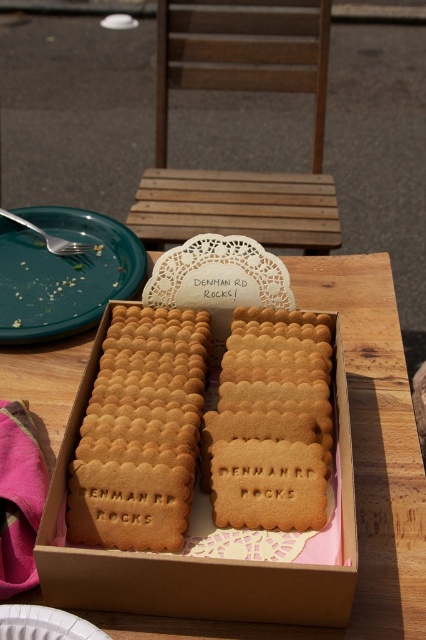
Question: Which is farther from the brown cardboard box at center?

Choices:
 (A) wooden picnic table at center
 (B) green matte plate at left
 (C) golden brown biscuit at center

Answer: (A)

Question: Which object is positioned farthest from the golden brown biscuit at center?

Choices:
 (A) green matte plate at left
 (B) brown cardboard box at center
 (C) white paper plate at lower left
 (D) wooden picnic table at center

Answer: (D)

Question: Is brown cardboard box at center wider than white paper plate at lower left?

Choices:
 (A) no
 (B) yes

Answer: (B)

Question: Does golden matte biscuit at center appear over white paper plate at lower left?

Choices:
 (A) yes
 (B) no

Answer: (A)

Question: Estimate the real-world distances between objects in this image. Which object is farther from the wooden picnic table at center?

Choices:
 (A) golden matte biscuit at center
 (B) brown cardboard box at center
 (C) green matte plate at left

Answer: (B)

Question: Observing the image, what is the correct spatial positioning of golden brown biscuit at center in reference to golden matte biscuit at center?

Choices:
 (A) left
 (B) right

Answer: (A)